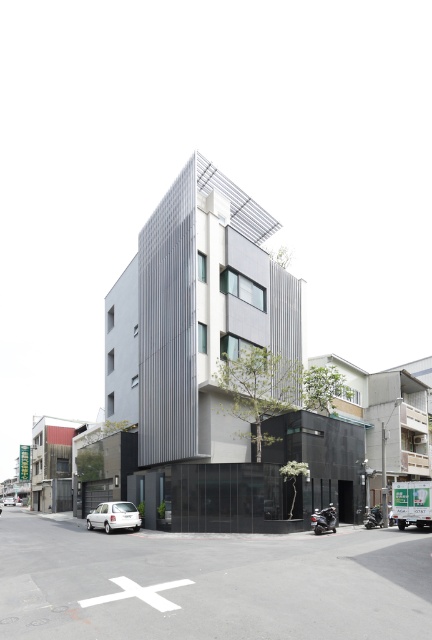
You are standing in front of the modern building and notice two points marked on its facade. The first point is at coordinates point (133, 513) and the second is at point (5, 504). Which of these points is closer to your viewpoint?

Point (133, 513) is closer to the camera than point (5, 504).

You are a delivery person trying to park your white matte car at lower left. There is another white matte car at center blocking the entrance. Can you drive your car forward without hitting the other car?

The white matte car at lower left is positioned over the white matte car at center, so you cannot drive forward without hitting the other car.

You are a delivery driver who needs to park your vehicle in the parking lot near the modern building. You have two white matte cars available for use today. The first is the white matte car at lower left, and the second is the white matte car at center. Which car should you choose if you want to park in a standard parking space that can only accommodate vehicles up to the size of the smaller car?

You should choose the white matte car at lower left because it is smaller than the white matte car at center, making it suitable for the standard parking space.